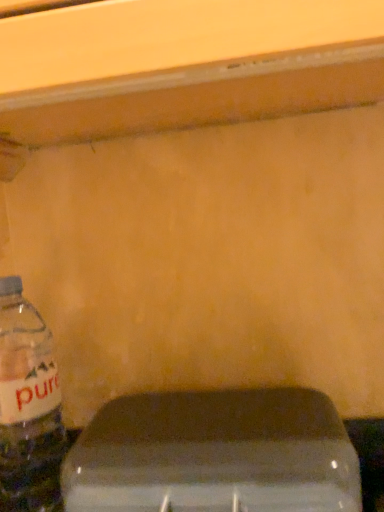
In order to face translucent plastic bottle at left, should I rotate leftwards or rightwards?

Turn left by 21.428 degrees to look at translucent plastic bottle at left.

Measure the distance between point (49, 505) and camera.

They are 51.60 centimeters apart.

At what (x,y) coordinates should I click in order to perform the action: click on translucent plastic bottle at left. Please return your answer as a coordinate pair (x, y). This screenshot has height=512, width=384. Looking at the image, I should click on (28, 407).

What do you see at coordinates (28, 407) in the screenshot?
I see `translucent plastic bottle at left` at bounding box center [28, 407].

The image size is (384, 512). In order to click on transparent plastic water at lower left in this screenshot , I will do `click(214, 455)`.

What do you see at coordinates (214, 455) in the screenshot? I see `transparent plastic water at lower left` at bounding box center [214, 455].

You are a GUI agent. You are given a task and a screenshot of the screen. Output one action in this format:
    pyautogui.click(x=<x>, y=<y>)
    Task: Click on the translucent plastic bottle at left
    The height and width of the screenshot is (512, 384).
    Given the screenshot: What is the action you would take?
    pyautogui.click(x=28, y=407)

Between transparent plastic water at lower left and translucent plastic bottle at left, which one appears on the left side from the viewer's perspective?

From the viewer's perspective, translucent plastic bottle at left appears more on the left side.

Considering their positions, is transparent plastic water at lower left located in front of or behind translucent plastic bottle at left?

Visually, transparent plastic water at lower left is located in front of translucent plastic bottle at left.

Between point (292, 461) and point (25, 364), which one is positioned in front?

The point (292, 461) is closer to the camera.

From the image's perspective, relative to translucent plastic bottle at left, is transparent plastic water at lower left above or below?

transparent plastic water at lower left is below translucent plastic bottle at left.

From a real-world perspective, which object rests below the other?

transparent plastic water at lower left is physically lower.

Considering the sizes of transparent plastic water at lower left and translucent plastic bottle at left in the image, is transparent plastic water at lower left wider or thinner than translucent plastic bottle at left?

Clearly, transparent plastic water at lower left has more width compared to translucent plastic bottle at left.

Who is shorter, transparent plastic water at lower left or translucent plastic bottle at left?

transparent plastic water at lower left is shorter.

Which of these two, transparent plastic water at lower left or translucent plastic bottle at left, is smaller?

translucent plastic bottle at left is smaller.

Which is correct: transparent plastic water at lower left is inside translucent plastic bottle at left, or outside of it?

transparent plastic water at lower left is not inside translucent plastic bottle at left, it's outside.

Are transparent plastic water at lower left and translucent plastic bottle at left beside each other?

transparent plastic water at lower left is not next to translucent plastic bottle at left, and they're not touching.

Could you tell me if transparent plastic water at lower left is facing translucent plastic bottle at left?

No, transparent plastic water at lower left does not turn towards translucent plastic bottle at left.

What's the angular difference between transparent plastic water at lower left and translucent plastic bottle at left's facing directions?

8.47e-05 degrees separate the facing orientations of transparent plastic water at lower left and translucent plastic bottle at left.

Locate an element on the screen. The height and width of the screenshot is (512, 384). appliance below the translucent plastic bottle at left (from a real-world perspective) is located at coordinates (214, 455).

Considering the relative positions of translucent plastic bottle at left and transparent plastic water at lower left in the image provided, is translucent plastic bottle at left to the left or to the right of transparent plastic water at lower left?

Clearly, translucent plastic bottle at left is on the left of transparent plastic water at lower left in the image.

Which is in front, translucent plastic bottle at left or transparent plastic water at lower left?

transparent plastic water at lower left is closer to the camera.

Is point (32, 360) closer to viewer compared to point (307, 429)?

No, it is behind (307, 429).

Looking at this image, from the image's perspective, between translucent plastic bottle at left and transparent plastic water at lower left, who is located below?

transparent plastic water at lower left is shown below in the image.

From a real-world perspective, which object stands above the other?

From a 3D spatial view, translucent plastic bottle at left is above.

Which of these two, translucent plastic bottle at left or transparent plastic water at lower left, is wider?

transparent plastic water at lower left is wider.

From their relative heights in the image, would you say translucent plastic bottle at left is taller or shorter than transparent plastic water at lower left?

In the image, translucent plastic bottle at left appears to be taller than transparent plastic water at lower left.

Considering the relative sizes of translucent plastic bottle at left and transparent plastic water at lower left in the image provided, is translucent plastic bottle at left bigger than transparent plastic water at lower left?

No.

From the picture: Does translucent plastic bottle at left contain transparent plastic water at lower left?

No, transparent plastic water at lower left is not a part of translucent plastic bottle at left.

Is translucent plastic bottle at left directly adjacent to transparent plastic water at lower left?

No, translucent plastic bottle at left is not beside transparent plastic water at lower left.

Looking at this image, is translucent plastic bottle at left looking in the opposite direction of transparent plastic water at lower left?

That's not correct — translucent plastic bottle at left is not looking away from transparent plastic water at lower left.

How many degrees apart are the facing directions of translucent plastic bottle at left and transparent plastic water at lower left?

translucent plastic bottle at left and transparent plastic water at lower left are facing 8.47e-05 degrees away from each other.

Locate an element on the screen. This screenshot has width=384, height=512. appliance below the translucent plastic bottle at left (from the image's perspective) is located at coordinates (214, 455).

Identify the location of bottle above the transparent plastic water at lower left (from a real-world perspective). (28, 407).

Where is `appliance in front of the translucent plastic bottle at left`? Image resolution: width=384 pixels, height=512 pixels. appliance in front of the translucent plastic bottle at left is located at coordinates (214, 455).